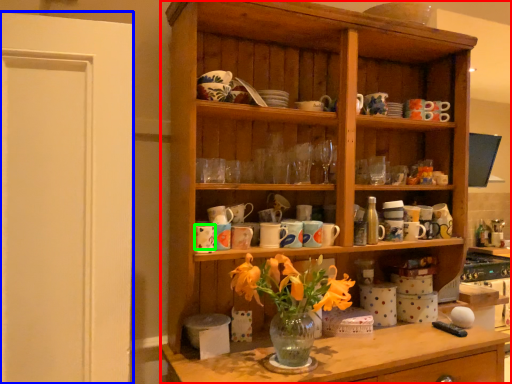
Question: Estimate the real-world distances between objects in this image. Which object is farther from cabinetry (highlighted by a red box), glass door (highlighted by a blue box) or tableware (highlighted by a green box)?

Choices:
 (A) glass door
 (B) tableware

Answer: (B)